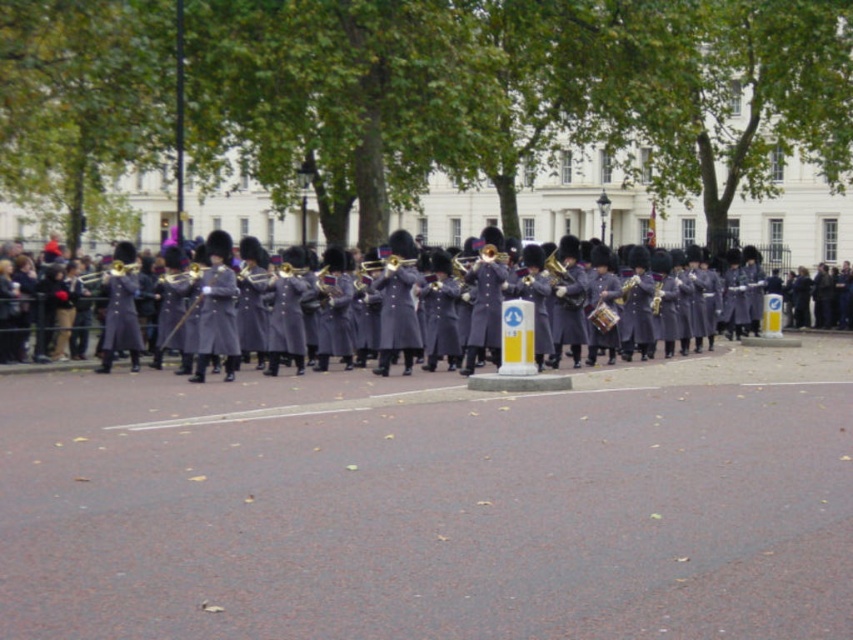
You are a photographer standing at the back of the parade. You want to capture a photo of the matte gray uniform at center and the matte gold trumpet at center. Which object will appear wider in the photo?

The matte gray uniform at center will appear wider in the photo because its width is larger than that of the matte gold trumpet at center.

You are a photographer trying to capture the band members during the parade. You notice the matte gray uniform at center and the matte gold trumpet at center. Which object should you focus on first if you want to take a sharp photo of the one that is nearer to you?

The matte gray uniform at center is closer to the viewer than the matte gold trumpet at center, so you should focus on the matte gray uniform at center first to ensure it is sharp in your photo.

You are a photographer positioned to capture the military band members. You notice the matte gray uniform at center and the matte gold trumpet at center. Which object should you focus on first if you want to photograph the lower one?

The matte gray uniform at center is below the matte gold trumpet at center, so you should focus on the matte gray uniform at center first to capture the lower one.